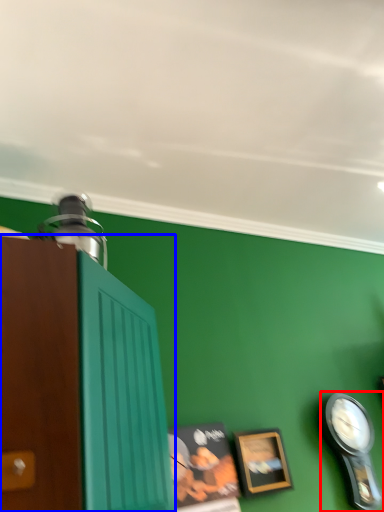
Question: Which point is closer to the camera, clock (highlighted by a red box) or cabinetry (highlighted by a blue box)?

Choices:
 (A) clock
 (B) cabinetry

Answer: (B)